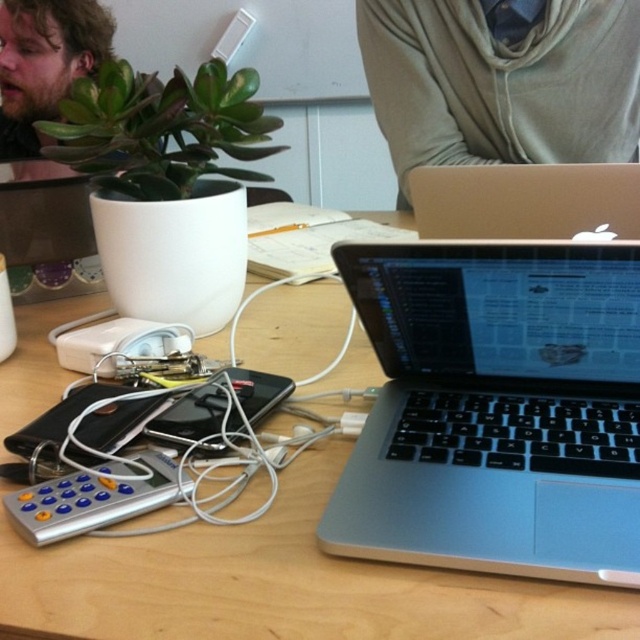
You are standing at the edge of the desk and want to pick up an item. You notice two points marked on the desk surface. Which point is closer to you, point (324,356) or point (132,472)?

Point (324,356) is closer to you because it is further to the viewer than point (132,472).